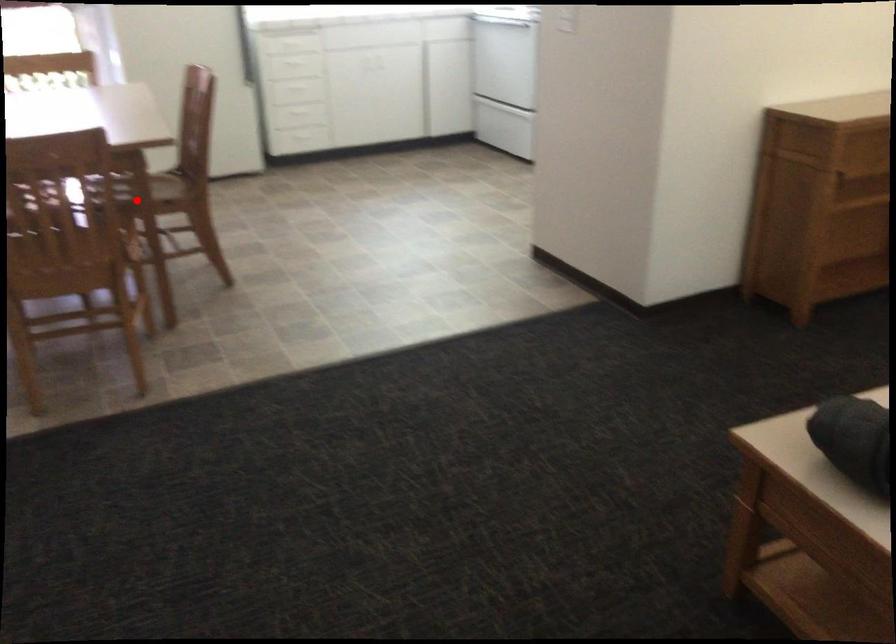
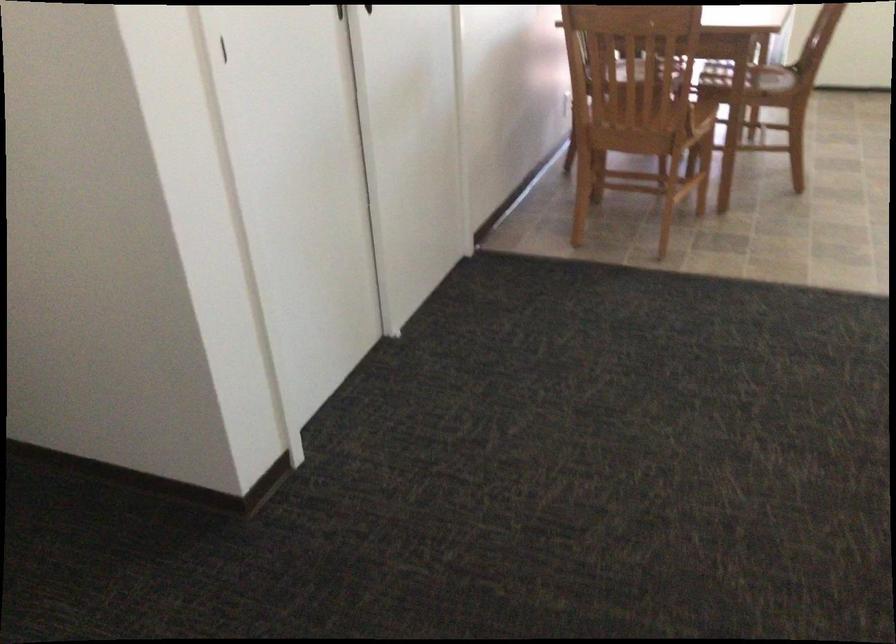
Find the pixel in the second image that matches the highlighted location in the first image.

(746, 84)